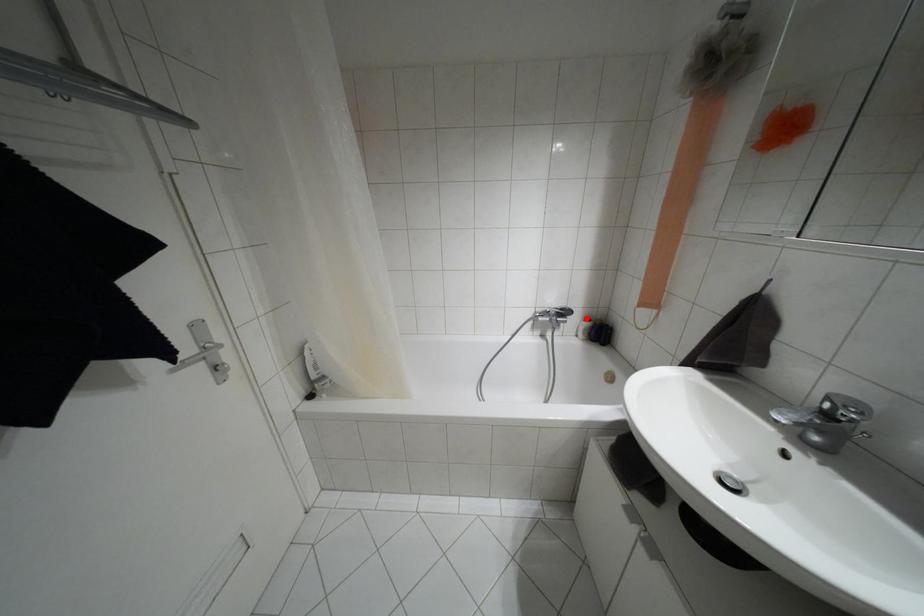
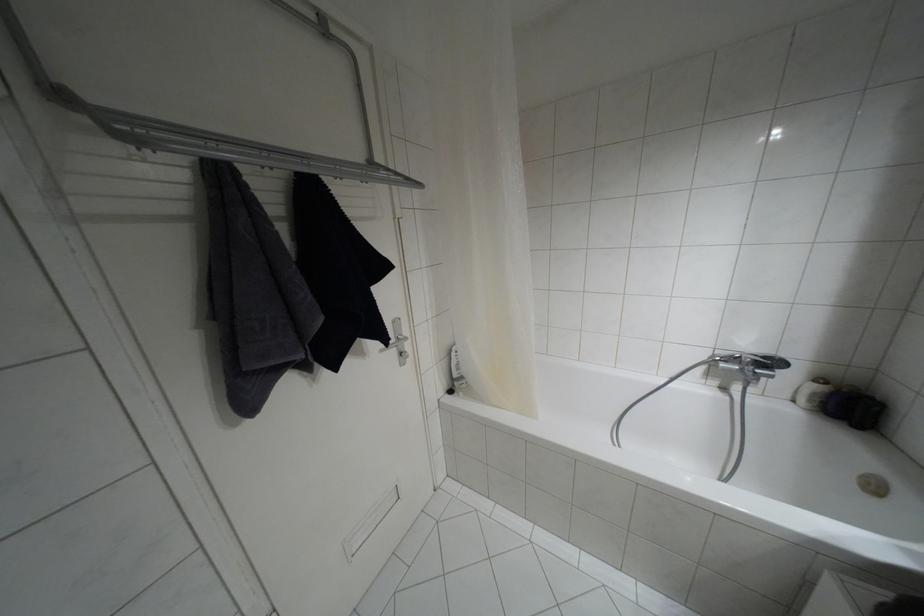
In the second image, find the point that corresponds to the highlighted location in the first image.

(820, 379)